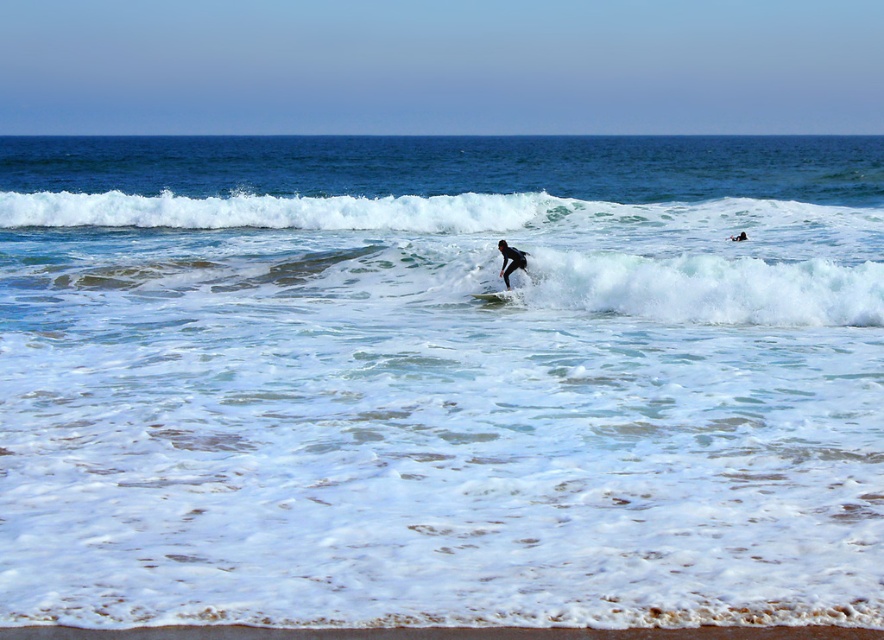
Question: Which of the following is the farthest from the observer?

Choices:
 (A) black rubber wetsuit at center
 (B) white foam surfboard at center
 (C) white foamy wave at upper center

Answer: (C)

Question: Is white foamy wave at upper center to the left of white foam surfboard at center from the viewer's perspective?

Choices:
 (A) no
 (B) yes

Answer: (B)

Question: Does white foamy wave at upper center lie behind white foam surfboard at center?

Choices:
 (A) yes
 (B) no

Answer: (A)

Question: Estimate the real-world distances between objects in this image. Which object is farther from the white foam surfboard at center?

Choices:
 (A) white foamy wave at upper center
 (B) black rubber wetsuit at center

Answer: (A)

Question: Considering the relative positions of white foamy wave at upper center and white foam surfboard at center in the image provided, where is white foamy wave at upper center located with respect to white foam surfboard at center?

Choices:
 (A) right
 (B) left

Answer: (B)

Question: Which object is positioned closest to the white foam surfboard at center?

Choices:
 (A) black rubber wetsuit at center
 (B) white foamy wave at upper center

Answer: (A)